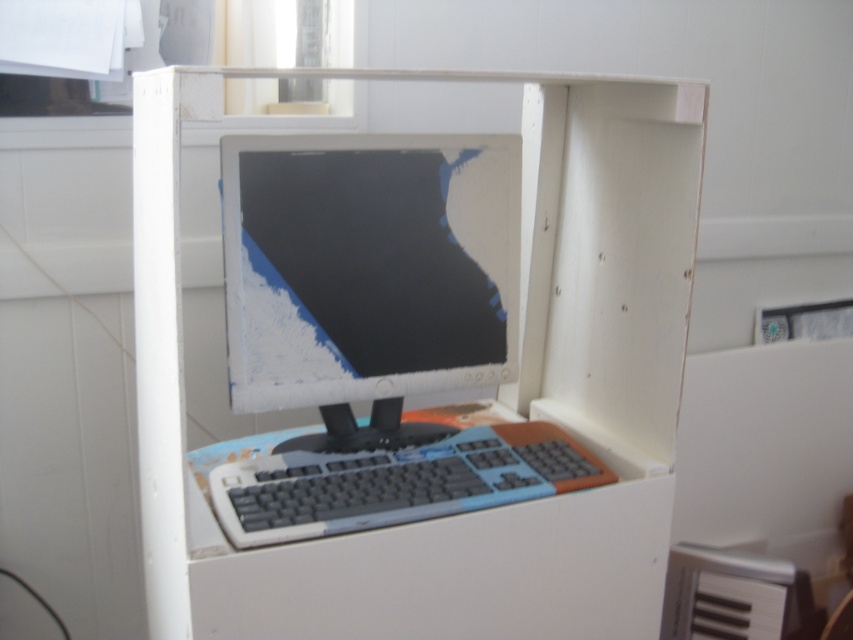
You are trying to clean the white plastic computer desk at center and the gray plastic keyboard at center. Since you can only reach items closer to you, which object should you clean first?

The white plastic computer desk at center is closer to the viewer than the gray plastic keyboard at center, so you should clean the white plastic computer desk at center first.

You are standing in front of the computer setup. You need to reach a point that is 1.2 meters away from you. Is the point at point coordinates point (x=494, y=204) within reach?

The distance of point (x=494, y=204) from camera is 1.23 meters, so yes, the point at point coordinates point (x=494, y=204) is within reach since it is 0.03 meters further than the desired distance.